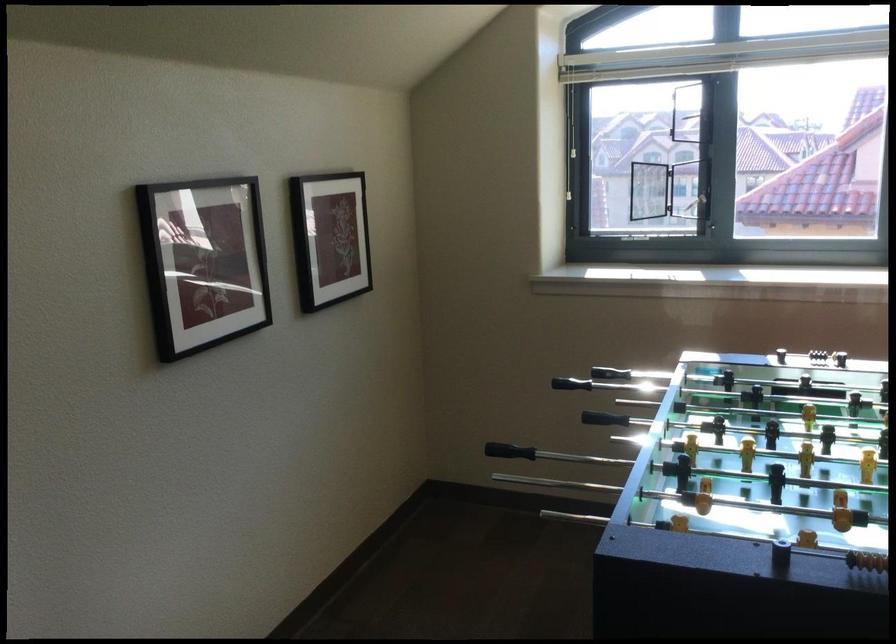
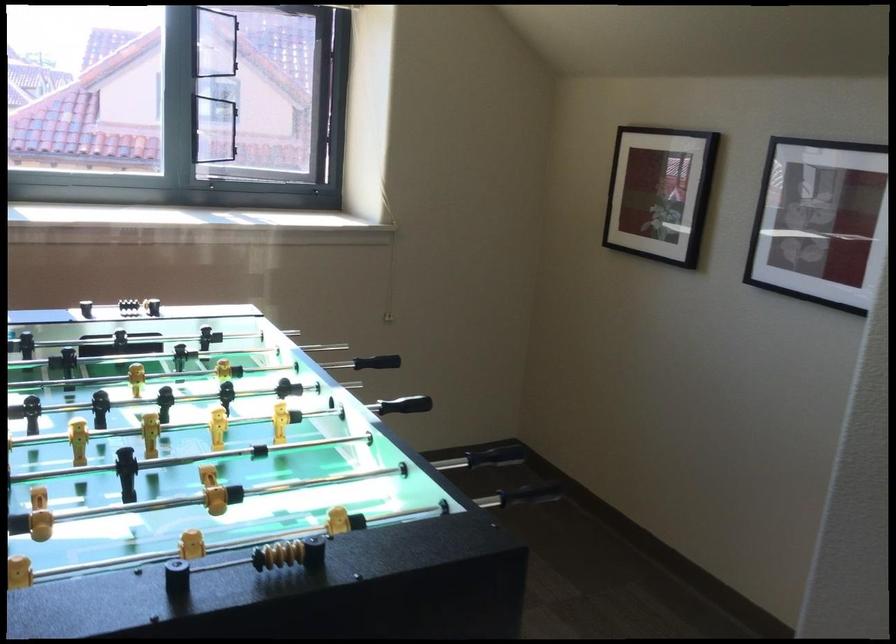
Question: The camera is either moving clockwise (left) or counter-clockwise (right) around the object. The first image is from the beginning of the video and the second image is from the end. Is the camera moving left or right when shooting the video?

Choices:
 (A) Left
 (B) Right

Answer: (A)